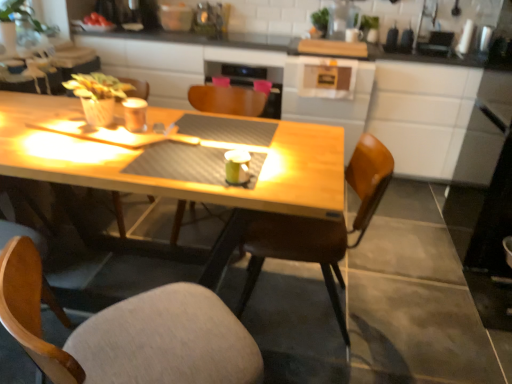
Question: Is matte metallic cup at center, the 1th coffee cup from the left, inside or outside of green matte mug at center, which is counted as the 1th coffee cup, starting from the front?

Choices:
 (A) inside
 (B) outside

Answer: (B)

Question: Is matte metallic cup at center, the 1th coffee cup from the left, wider or thinner than green matte mug at center, which is the first coffee cup in bottom-to-top order?

Choices:
 (A) wide
 (B) thin

Answer: (A)

Question: Based on their relative distances, which object is farther from the wooden table at center?

Choices:
 (A) matte metallic cup at center, which is the second coffee cup in right-to-left order
 (B) wooden chair at center, arranged as the third chair when viewed from the front
 (C) green matte mug at center, which is the second coffee cup from top to bottom
 (D) wooden chair at lower center, acting as the 1th chair starting from the front
 (E) green leafy plant at upper left

Answer: (D)

Question: Which of these objects is positioned farthest from the wooden chair at lower center, the third chair when ordered from back to front?

Choices:
 (A) wooden table at center
 (B) matte metallic cup at center, marked as the first coffee cup in a back-to-front arrangement
 (C) green leafy plant at upper left
 (D) wooden chair at center, the first chair in the back-to-front sequence
 (E) green matte mug at center, which is the first coffee cup in bottom-to-top order

Answer: (C)